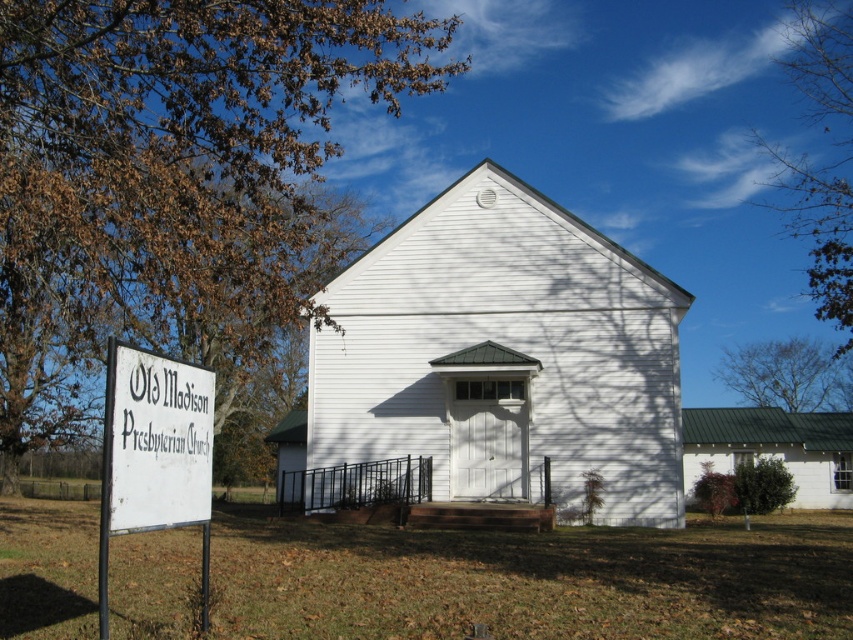
You are a visitor at the Old Madison Presbyterian Church and notice two elements at the upper right corner of the scene. Which one is bigger in size between the brown leafy tree at upper right and the bare branches at upper right?

The brown leafy tree at upper right is larger in size than the bare branches at upper right.

You are standing in front of the Old Madison Presbyterian Church and want to read the white wooden sign at left and also notice the bare branches at upper right. Which object is nearer to you?

The white wooden sign at left is closer to the viewer than the bare branches at upper right.